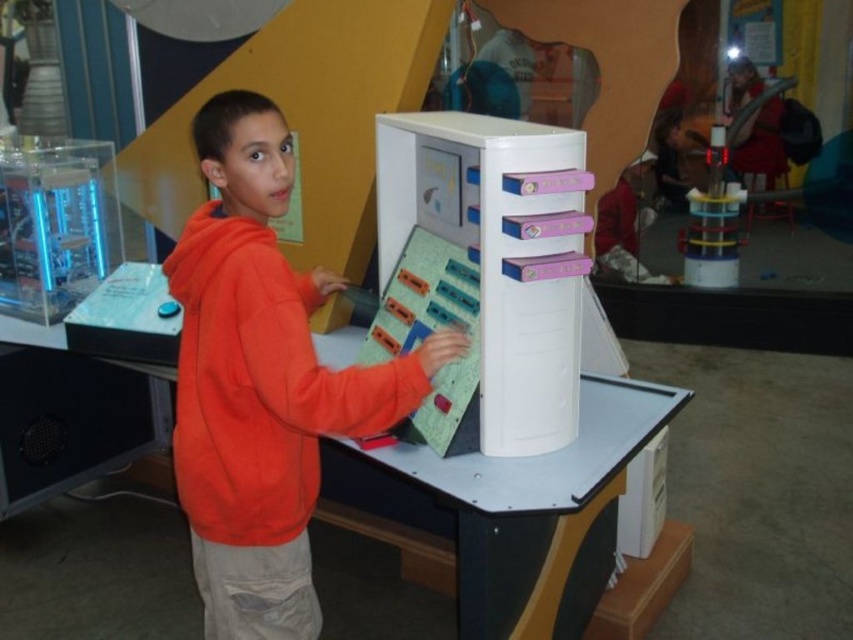
Between orange fleece at center and white plastic table at center, which one is positioned higher?

Positioned higher is orange fleece at center.

What do you see at coordinates (262, 381) in the screenshot? I see `orange fleece at center` at bounding box center [262, 381].

This screenshot has width=853, height=640. I want to click on orange fleece at center, so click(262, 381).